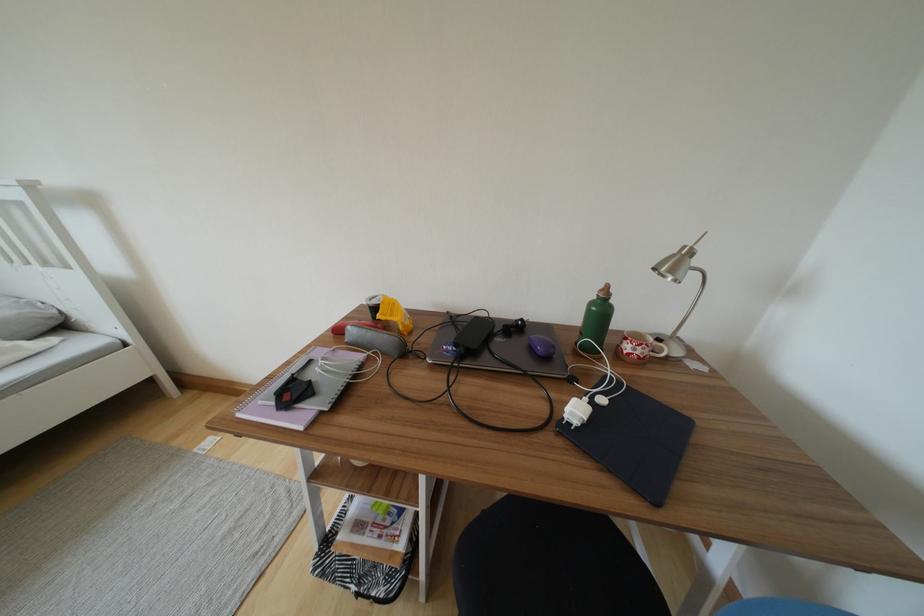
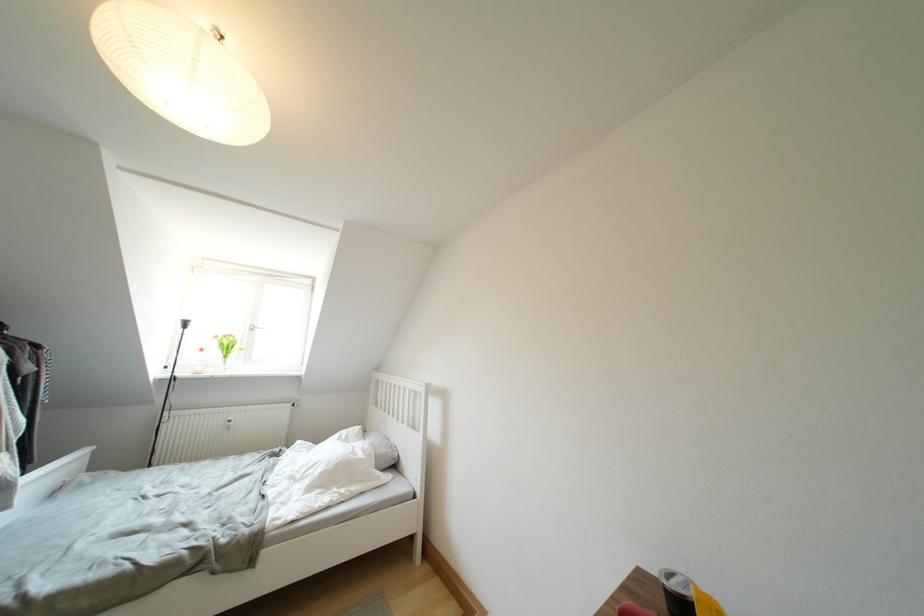
Where in the second image is the point corresponding to pixel 379 305 from the first image?

(678, 589)